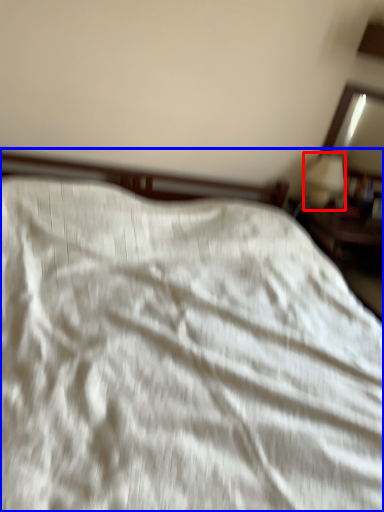
Question: Which of the following is the closest to the observer, table lamp (highlighted by a red box) or bed (highlighted by a blue box)?

Choices:
 (A) table lamp
 (B) bed

Answer: (B)